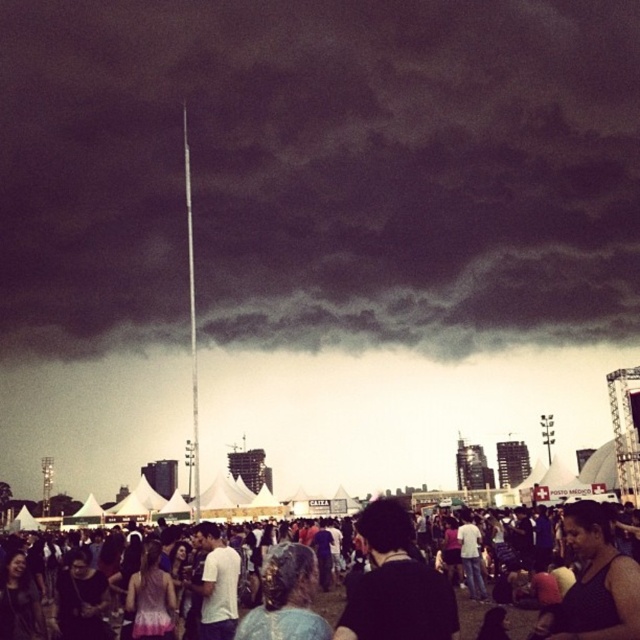
You are a photographer trying to capture a clear shot of the black tank top at lower right without the matte black crowd at center blocking it. Based on their relative sizes, can you suggest a way to adjust your camera angle?

Since the matte black crowd at center is taller than the black tank top at lower right, you can lower your camera angle to position it below the crowd, allowing you to capture the tank top without obstruction.

You are standing at the origin point of the coordinate system in the image. You want to move towards the matte black crowd at center. What are the coordinates you need to move to reach them?

The coordinates to reach the matte black crowd at center are point (355,589).

You are a photographer at the festival. You want to capture a photo of the black tank top at lower right without including the matte black crowd at center in the frame. Is this possible based on their positions?

The matte black crowd at center is located below the black tank top at lower right, so it is possible to capture the black tank top at lower right without including the matte black crowd at center in the frame by adjusting the camera angle to exclude the lower area.